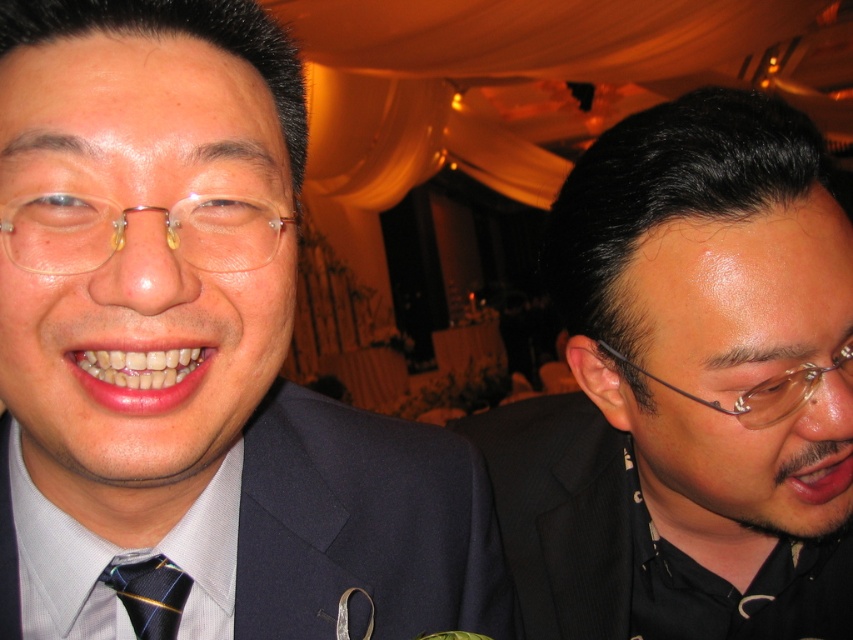
You are a photographer at a formal event. You need to position two subjects wearing the matte black suit at center and the black pinstripe suit at right. According to the scene description, which subject should be placed to the left side of the other?

The matte black suit at center should be placed to the left of the black pinstripe suit at right as per the description.